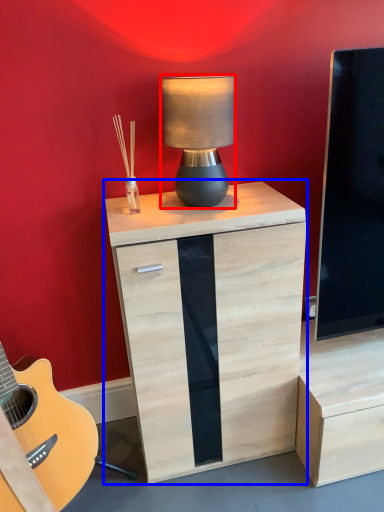
Question: Among these objects, which one is farthest to the camera, lamp (highlighted by a red box) or chest of drawers (highlighted by a blue box)?

Choices:
 (A) lamp
 (B) chest of drawers

Answer: (B)